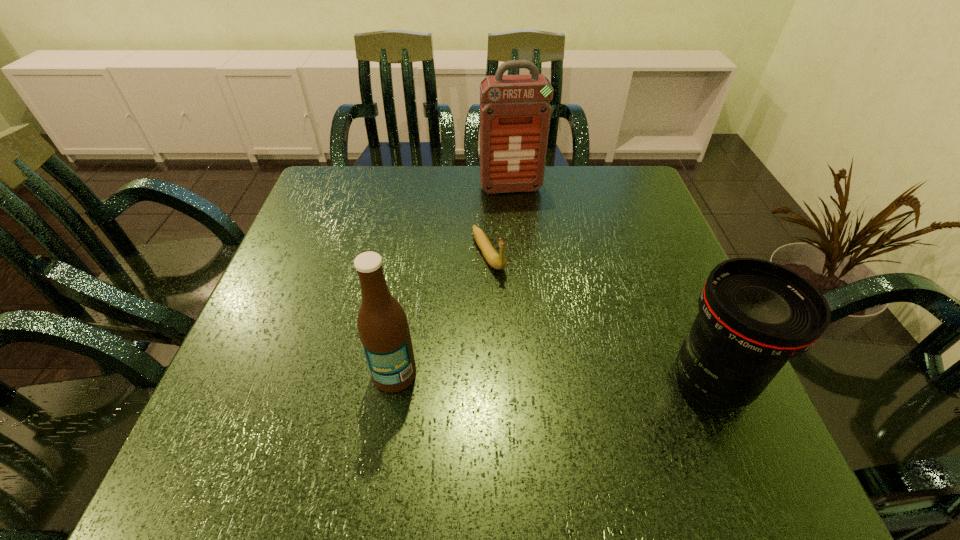
The image size is (960, 540). Find the location of `object that is at the near right corner`. object that is at the near right corner is located at coordinates (754, 315).

What are the coordinates of `free space at the far edge of the desktop` in the screenshot? It's located at (474, 169).

The height and width of the screenshot is (540, 960). Identify the location of vacant region at the near edge of the desktop. (616, 411).

This screenshot has width=960, height=540. Identify the location of free space at the left edge of the desktop. (298, 240).

Identify the location of vacant space at the right edge. The width and height of the screenshot is (960, 540). (666, 230).

The width and height of the screenshot is (960, 540). In the image, there is a desktop. In order to click on free space at the far left corner in this screenshot , I will do `click(329, 196)`.

The height and width of the screenshot is (540, 960). What are the coordinates of `free space at the near right corner` in the screenshot? It's located at (676, 399).

Find the location of a particular element. free spot between the first-aid kit and the rightmost object is located at coordinates (612, 285).

I want to click on free space between the tallest object and the beer bottle, so click(452, 281).

The width and height of the screenshot is (960, 540). I want to click on vacant space that is in between the third nearest object and the rightmost object, so click(600, 318).